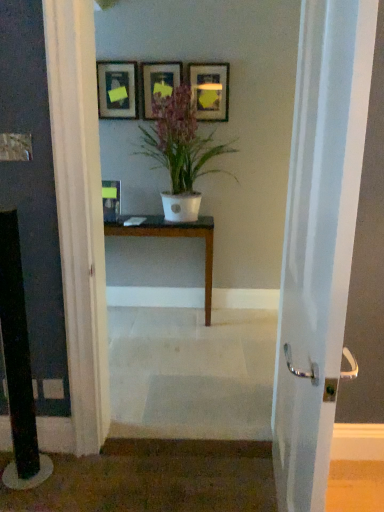
This screenshot has height=512, width=384. I want to click on vacant space in dark brown wood table at center (from a real-world perspective), so click(x=163, y=320).